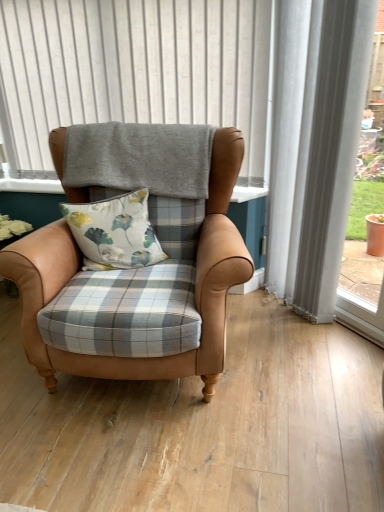
What is the approximate height of floral fabric cushion at center?

19.00 inches.

Where is `gray fabric at upper center`? The height and width of the screenshot is (512, 384). gray fabric at upper center is located at coordinates (135, 73).

What's the angular difference between leather armchair at center and floral fabric cushion at center's facing directions?

The angle between the facing direction of leather armchair at center and the facing direction of floral fabric cushion at center is 18.6 degrees.

Which of these two, leather armchair at center or floral fabric cushion at center, is wider?

leather armchair at center is wider.

Looking at this image, who is more distant, leather armchair at center or floral fabric cushion at center?

floral fabric cushion at center is behind.

In the scene shown: Which of these two, leather armchair at center or gray fabric at upper center, is wider?

With larger width is leather armchair at center.

Does leather armchair at center contain gray fabric at upper center?

No, gray fabric at upper center is located outside of leather armchair at center.

In the scene shown: Considering the sizes of objects leather armchair at center and gray fabric at upper center in the image provided, who is smaller, leather armchair at center or gray fabric at upper center?

With smaller size is gray fabric at upper center.

Is leather armchair at center far away from gray fabric at upper center?

No, there isn't a large distance between leather armchair at center and gray fabric at upper center.

Is floral fabric cushion at center next to gray fabric at upper center?

No, floral fabric cushion at center is not with gray fabric at upper center.

In the scene shown: Is floral fabric cushion at center not within gray fabric at upper center?

floral fabric cushion at center lies outside gray fabric at upper center's area.

Between floral fabric cushion at center and gray fabric at upper center, which one has smaller width?

With smaller width is gray fabric at upper center.

Is floral fabric cushion at center positioned with its back to leather armchair at center?

Yes.

Which of these two, floral fabric cushion at center or leather armchair at center, is bigger?

Bigger between the two is leather armchair at center.

Does floral fabric cushion at center have a greater height compared to leather armchair at center?

No, floral fabric cushion at center is not taller than leather armchair at center.

Between gray fabric at upper center and floral fabric cushion at center, which one appears on the left side from the viewer's perspective?

Positioned to the left is gray fabric at upper center.

Based on their sizes in the image, would you say gray fabric at upper center is bigger or smaller than floral fabric cushion at center?

In the image, gray fabric at upper center appears to be larger than floral fabric cushion at center.

Is gray fabric at upper center aimed at floral fabric cushion at center?

Yes, gray fabric at upper center is turned towards floral fabric cushion at center.

From the image's perspective, is gray fabric at upper center under floral fabric cushion at center?

Incorrect, from the image's perspective, gray fabric at upper center is higher than floral fabric cushion at center.

Is gray fabric at upper center looking in the opposite direction of leather armchair at center?

gray fabric at upper center does not have its back to leather armchair at center.

From a real-world perspective, which is physically above, gray fabric at upper center or leather armchair at center?

From a 3D spatial view, gray fabric at upper center is above.

Based on the photo, would you say gray fabric at upper center is outside leather armchair at center?

Yes.

The image size is (384, 512). Identify the location of chair below the floral fabric cushion at center (from the image's perspective). (195, 290).

Locate an element on the screen. The width and height of the screenshot is (384, 512). bay window above the leather armchair at center (from a real-world perspective) is located at coordinates (135, 73).

Estimate the real-world distances between objects in this image. Which object is closer to gray fabric at upper center, leather armchair at center or floral fabric cushion at center?

The object closer to gray fabric at upper center is leather armchair at center.

Looking at the image, which one is located further to floral fabric cushion at center, leather armchair at center or gray fabric at upper center?

Among the two, gray fabric at upper center is located further to floral fabric cushion at center.

When comparing their distances from leather armchair at center, does gray fabric at upper center or floral fabric cushion at center seem closer?

floral fabric cushion at center is closer to leather armchair at center.

Which object lies nearer to the anchor point floral fabric cushion at center, gray fabric at upper center or leather armchair at center?

leather armchair at center lies closer to floral fabric cushion at center than the other object.

Which object lies further to the anchor point leather armchair at center, floral fabric cushion at center or gray fabric at upper center?

gray fabric at upper center is positioned further to the anchor leather armchair at center.

When comparing their distances from gray fabric at upper center, does floral fabric cushion at center or leather armchair at center seem closer?

leather armchair at center lies closer to gray fabric at upper center than the other object.

The width and height of the screenshot is (384, 512). Find the location of `pillow between gray fabric at upper center and leather armchair at center in the vertical direction`. pillow between gray fabric at upper center and leather armchair at center in the vertical direction is located at coordinates (114, 232).